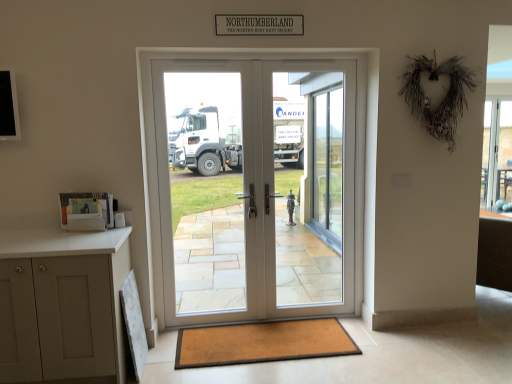
This screenshot has height=384, width=512. What do you see at coordinates (208, 193) in the screenshot?
I see `white glossy door at center, the second screen door positioned from the right` at bounding box center [208, 193].

What do you see at coordinates (307, 190) in the screenshot? I see `white glossy screen door at center, acting as the second screen door starting from the left` at bounding box center [307, 190].

At what (x,y) coordinates should I click in order to perform the action: click on clear glass door at center. Please return your answer as a coordinate pair (x, y). Looking at the image, I should click on (326, 165).

Identify the location of clear glass window at right. (497, 154).

Considering the positions of objects white glossy door at center and clear glass door at center in the image provided, who is in front, white glossy door at center or clear glass door at center?

Positioned in front is white glossy door at center.

Is there a large distance between white glossy door at center and clear glass door at center?

No.

Can you confirm if white glossy door at center is positioned to the left of clear glass door at center?

Correct, you'll find white glossy door at center to the left of clear glass door at center.

Would you say white glossy door at center is outside clear glass window at right?

Yes, white glossy door at center is outside of clear glass window at right.

Is white glossy door at center positioned with its back to clear glass window at right?

No, white glossy door at center is not facing away from clear glass window at right.

Between point (351, 200) and point (508, 123), which one is positioned in front?

Point (508, 123)

Which of these two, white glossy door at center or clear glass window at right, is bigger?

white glossy door at center.

Looking at their sizes, would you say clear glass window at right is wider or thinner than clear glass door at center?

In the image, clear glass window at right appears to be wider than clear glass door at center.

Between clear glass window at right and clear glass door at center, which one appears on the left side from the viewer's perspective?

From the viewer's perspective, clear glass door at center appears more on the left side.

You are a GUI agent. You are given a task and a screenshot of the screen. Output one action in this format:
    pyautogui.click(x=<x>, y=<y>)
    Task: Click on the glass door that appears below the clear glass window at right (from the image's perspective)
    This screenshot has height=384, width=512.
    Given the screenshot: What is the action you would take?
    pyautogui.click(x=326, y=165)

From a real-world perspective, which is physically above, brown textured mat at lower center or clear glass window at right?

In real-world perspective, clear glass window at right is above.

Could you tell me if brown textured mat at lower center is turned towards clear glass window at right?

No, brown textured mat at lower center is not oriented towards clear glass window at right.

Considering the relative sizes of brown textured mat at lower center and clear glass window at right in the image provided, is brown textured mat at lower center bigger than clear glass window at right?

No.

Can we say brown textured mat at lower center lies outside clear glass window at right?

Indeed, brown textured mat at lower center is completely outside clear glass window at right.

Is point (497, 142) in front of point (221, 270)?

Yes, it is.

Could white glossy door at center, which is the first screen door in left-to-right order, be considered to be inside clear glass window at right?

That's incorrect, white glossy door at center, which is the first screen door in left-to-right order, is not inside clear glass window at right.

From their relative heights in the image, would you say clear glass window at right is taller or shorter than white glossy door at center, the second screen door positioned from the right?

Clearly, clear glass window at right is shorter compared to white glossy door at center, the second screen door positioned from the right.

Based on the photo, from a real-world perspective, is clear glass window at right on top of white glossy door at center, which is the first screen door in left-to-right order?

Correct, in the physical world, clear glass window at right is higher than white glossy door at center, which is the first screen door in left-to-right order.

From a real-world perspective, who is located lower, white glossy screen door at center, acting as the second screen door starting from the left, or clear glass door at center?

In real-world perspective, white glossy screen door at center, acting as the second screen door starting from the left, is lower.

From the image's perspective, is white glossy screen door at center, positioned as the 1th screen door in right-to-left order, positioned above or below clear glass door at center?

Clearly, from the image's perspective, white glossy screen door at center, positioned as the 1th screen door in right-to-left order, is below clear glass door at center.

Is white glossy screen door at center, positioned as the 1th screen door in right-to-left order, facing away from clear glass door at center?

No.

In the scene shown: Considering the relative positions of clear glass door at center and brown textured mat at lower center in the image provided, is clear glass door at center to the left of brown textured mat at lower center from the viewer's perspective?

Incorrect, clear glass door at center is not on the left side of brown textured mat at lower center.

From a real-world perspective, does clear glass door at center stand above brown textured mat at lower center?

Correct, in the physical world, clear glass door at center is higher than brown textured mat at lower center.

Consider the image. From the image's perspective, is clear glass door at center above or below brown textured mat at lower center?

clear glass door at center is situated higher than brown textured mat at lower center in the image.

Considering the relative sizes of clear glass door at center and brown textured mat at lower center in the image provided, is clear glass door at center taller than brown textured mat at lower center?

Correct, clear glass door at center is much taller as brown textured mat at lower center.

Where is `glass door located above the white glossy door at center (from the image's perspective)`? glass door located above the white glossy door at center (from the image's perspective) is located at coordinates (326, 165).

The image size is (512, 384). Identify the location of door in front of the clear glass window at right. click(x=256, y=188).

Looking at this image, from the image, which object appears to be nearer to clear glass window at right, brown textured mat at lower center or white glossy door at center, the second screen door positioned from the right?

The object closer to clear glass window at right is brown textured mat at lower center.

When comparing their distances from clear glass window at right, does white glossy door at center or clear glass door at center seem closer?

The object closer to clear glass window at right is clear glass door at center.

Considering their positions, is clear glass window at right positioned further to white glossy door at center, the second screen door positioned from the right, than brown textured mat at lower center?

The object further to white glossy door at center, the second screen door positioned from the right, is brown textured mat at lower center.

When comparing their distances from white glossy screen door at center, positioned as the 1th screen door in right-to-left order, does brown textured mat at lower center or white glossy door at center seem closer?

Based on the image, white glossy door at center appears to be nearer to white glossy screen door at center, positioned as the 1th screen door in right-to-left order.

From the picture: Which object lies nearer to the anchor point clear glass window at right, white glossy screen door at center, positioned as the 1th screen door in right-to-left order, or brown textured mat at lower center?

Among the two, brown textured mat at lower center is located nearer to clear glass window at right.

Based on their spatial positions, is white glossy door at center or clear glass window at right further from white glossy door at center, the second screen door positioned from the right?

clear glass window at right.

Looking at the image, which one is located further to brown textured mat at lower center, clear glass window at right or white glossy door at center?

white glossy door at center is further to brown textured mat at lower center.

Based on their spatial positions, is white glossy door at center or clear glass window at right closer to brown textured mat at lower center?

clear glass window at right is closer to brown textured mat at lower center.

You are a GUI agent. You are given a task and a screenshot of the screen. Output one action in this format:
    pyautogui.click(x=<x>, y=<y>)
    Task: Click on the glass door between white glossy door at center and clear glass window at right from left to right
    The height and width of the screenshot is (384, 512).
    Given the screenshot: What is the action you would take?
    pyautogui.click(x=326, y=165)

The width and height of the screenshot is (512, 384). I want to click on glass door between white glossy door at center, which is the first screen door in left-to-right order, and clear glass window at right, in the horizontal direction, so click(326, 165).

Locate an element on the screen. door between brown textured mat at lower center and clear glass window at right in the front-back direction is located at coordinates (256, 188).

Image resolution: width=512 pixels, height=384 pixels. I want to click on glass door situated between white glossy screen door at center, positioned as the 1th screen door in right-to-left order, and clear glass window at right from left to right, so click(x=326, y=165).